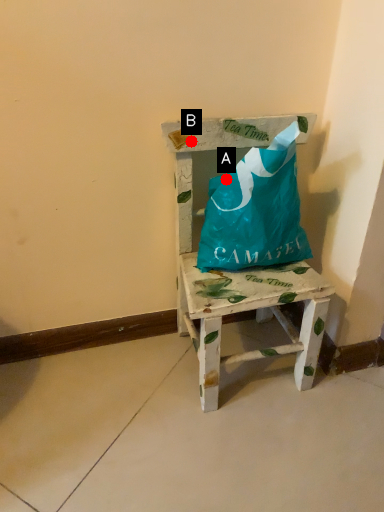
Question: Two points are circled on the image, labeled by A and B beside each circle. Which point is closer to the camera taking this photo?

Choices:
 (A) A is closer
 (B) B is closer

Answer: (B)